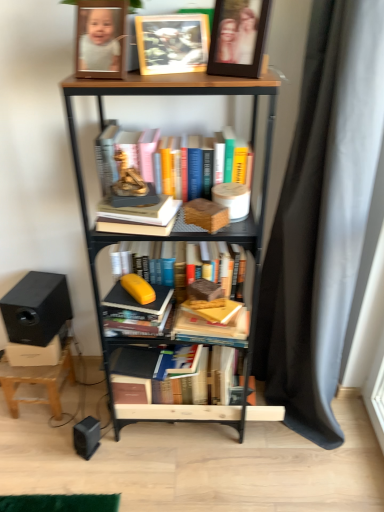
This screenshot has width=384, height=512. What are the coordinates of `vacant space in front of black plastic speaker at lower left, the first speaker in the right-to-left sequence` in the screenshot? It's located at (87, 483).